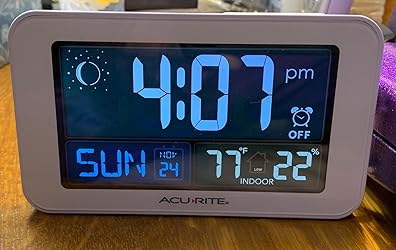
The image size is (396, 250). I want to click on surface, so click(304, 236).